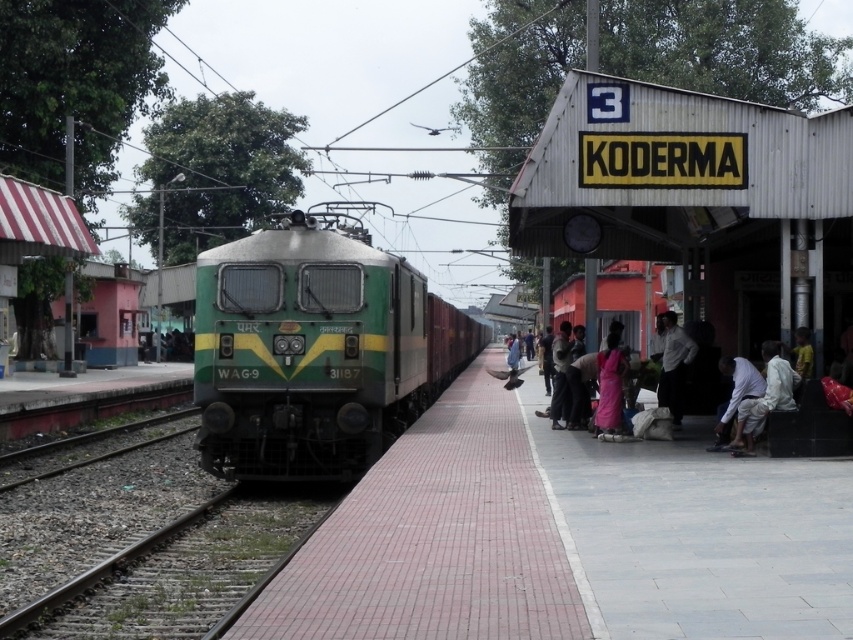
You are a photographer standing at the Koderma railway station platform. You notice a person wearing a white shirt at center and a pink fabric at center in the scene. Which item is located to the right of the other?

The pink fabric at center is positioned on the right side of white shirt at center.

You are a photographer standing at the railway station in Koderma. You want to take a photo that includes both the pink tile platform at center and the white cotton clothing at lower right. Which object should you frame first to ensure both are visible in the photo?

The pink tile platform at center is bigger than the white cotton clothing at lower right, so you should frame the pink tile platform at center first to ensure both are visible in the photo.